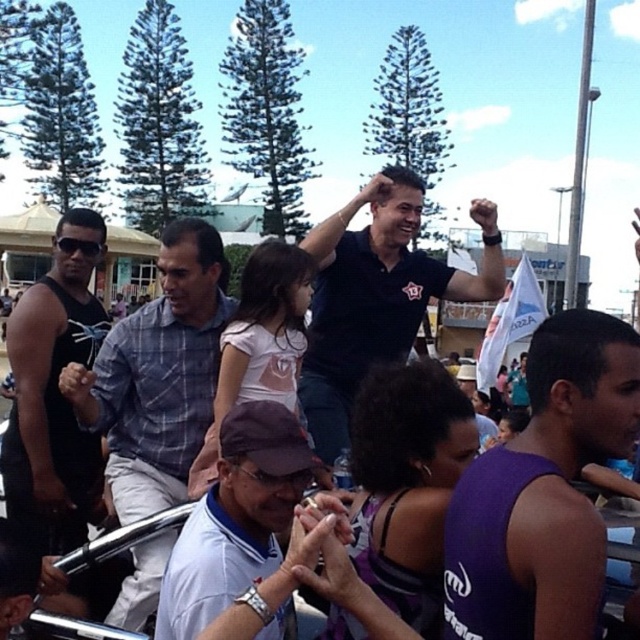
Based on the photo, you are organizing a photo shoot and need to ensure proper lighting. The white matte cap at center and the black matte tank top at left are key elements. Given that the camera requires a minimum distance of 1.5 meters between subjects for optimal focus, will these two items meet the requirement?

The white matte cap at center is 1.37 meters from the black matte tank top at left, which is less than the required 1.5 meters. Therefore, they will not meet the camera focus requirement.

You are observing a group of people at a celebration. You notice two individuals wearing purple sleeveless shirt at center and black matte tank top at left. Which of these two is shorter in height?

The purple sleeveless shirt at center is not as tall as the black matte tank top at left, so the person wearing the purple sleeveless shirt at center is shorter.

You are organizing a photo shoot and need to arrange the dark blue shirt at center and the black matte tank top at left based on their sizes. Which one should you place in a position that requires a larger garment?

The black matte tank top at left should be placed in the position requiring a larger garment since it is bigger than the dark blue shirt at center.